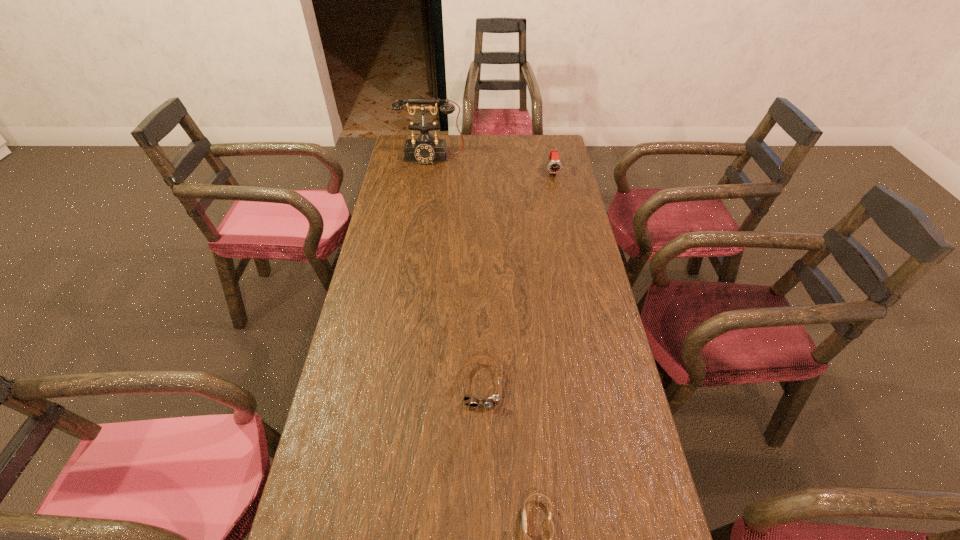
Where is `object at the left edge`? This screenshot has width=960, height=540. object at the left edge is located at coordinates (425, 149).

The height and width of the screenshot is (540, 960). Find the location of `object present at the right edge`. object present at the right edge is located at coordinates (554, 166).

Where is `object located at the far left corner`? object located at the far left corner is located at coordinates (425, 149).

This screenshot has height=540, width=960. Find the location of `free region at the far edge of the desktop`. free region at the far edge of the desktop is located at coordinates (497, 157).

Find the location of a particular element. The height and width of the screenshot is (540, 960). free space at the left edge of the desktop is located at coordinates (398, 186).

This screenshot has height=540, width=960. Find the location of `free space at the right edge`. free space at the right edge is located at coordinates (561, 345).

Image resolution: width=960 pixels, height=540 pixels. Find the location of `vacant space at the far right corner of the desktop`. vacant space at the far right corner of the desktop is located at coordinates (553, 138).

This screenshot has height=540, width=960. What are the coordinates of `vacant area between the third object from right to left and the farther watch` in the screenshot? It's located at (517, 278).

You are a GUI agent. You are given a task and a screenshot of the screen. Output one action in this format:
    pyautogui.click(x=<x>, y=<y>)
    Task: Click on the unoccupied area between the farther watch and the tallest object
    Image resolution: width=960 pixels, height=540 pixels.
    Given the screenshot: What is the action you would take?
    pyautogui.click(x=492, y=165)

Locate an element on the screen. free space that is in between the telephone and the taller watch is located at coordinates (492, 165).